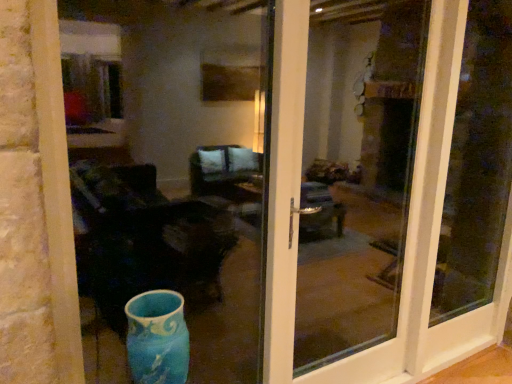
Question: Should I look upward or downward to see white glossy door at center?

Choices:
 (A) down
 (B) up

Answer: (A)